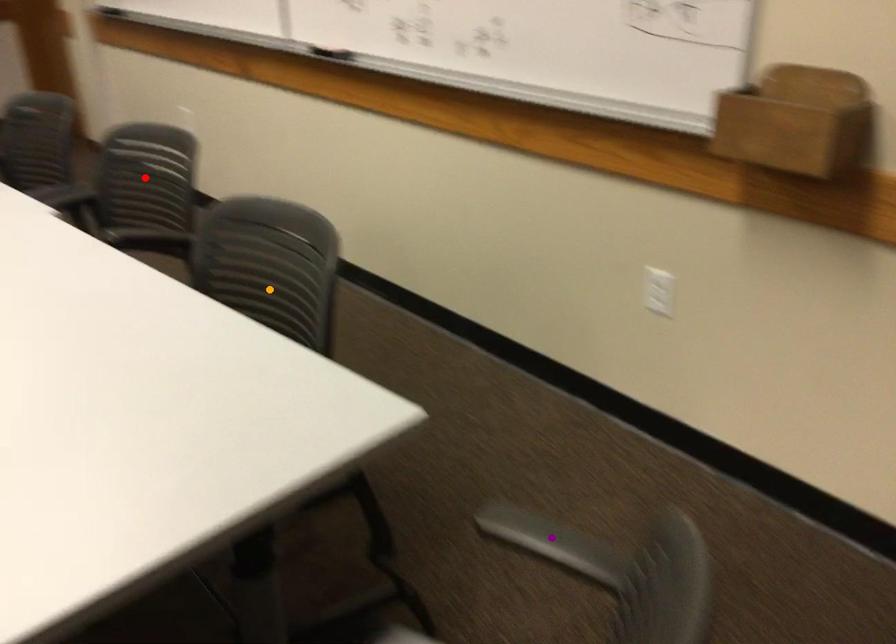
Order these from nearest to farthest:
orange point
purple point
red point

red point → orange point → purple point